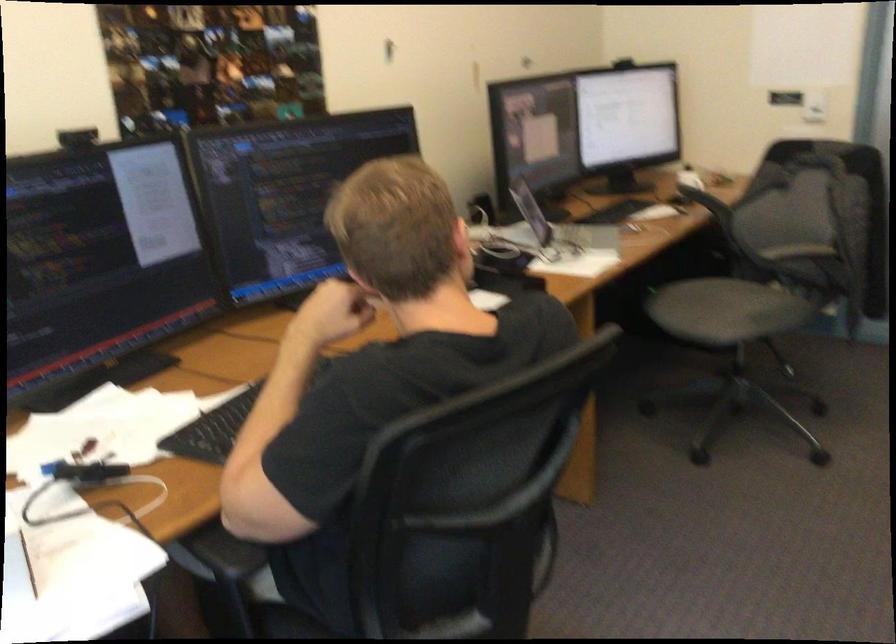
Find where to lift the silver laptop. Please return your answer as a coordinate pair (x, y).

(561, 230)